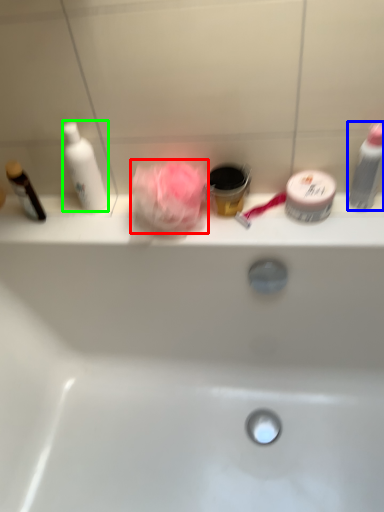
Question: Considering the real-world distances, which object is farthest from rose (highlighted by a red box)? toiletry (highlighted by a blue box) or cleaning product (highlighted by a green box)?

Choices:
 (A) toiletry
 (B) cleaning product

Answer: (A)